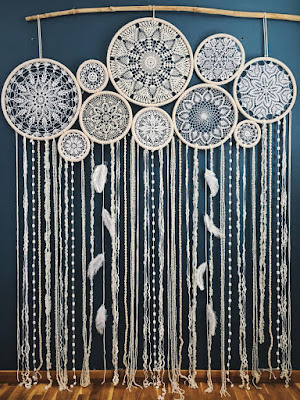
Identify the location of hardwood floor. The width and height of the screenshot is (300, 400). (77, 387), (29, 393), (105, 388), (189, 396), (271, 392), (285, 386).